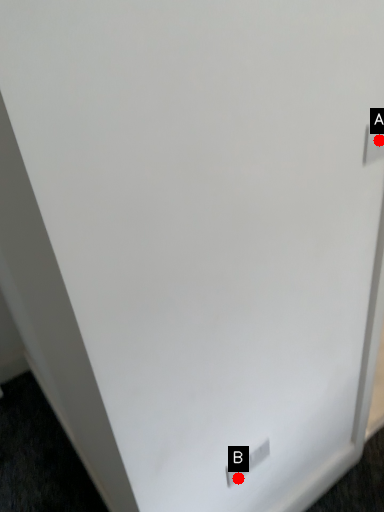
Question: Two points are circled on the image, labeled by A and B beside each circle. Which point is closer to the camera?

Choices:
 (A) A is closer
 (B) B is closer

Answer: (A)